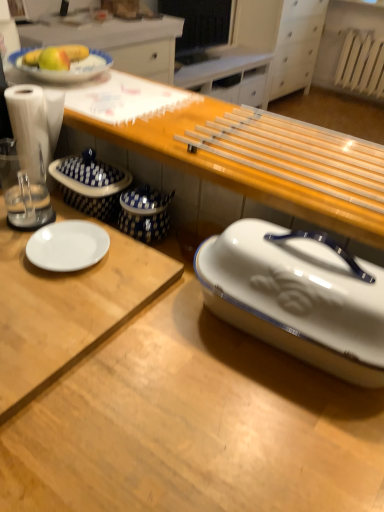
Question: Is yellow matte apple at upper left positioned in front of transparent plastic blender at left?

Choices:
 (A) no
 (B) yes

Answer: (A)

Question: Does yellow matte apple at upper left appear on the right side of transparent plastic blender at left?

Choices:
 (A) yes
 (B) no

Answer: (B)

Question: Is yellow matte apple at upper left wider than transparent plastic blender at left?

Choices:
 (A) yes
 (B) no

Answer: (B)

Question: Does yellow matte apple at upper left touch transparent plastic blender at left?

Choices:
 (A) no
 (B) yes

Answer: (A)

Question: Considering the relative sizes of yellow matte apple at upper left and transparent plastic blender at left in the image provided, is yellow matte apple at upper left taller than transparent plastic blender at left?

Choices:
 (A) yes
 (B) no

Answer: (B)

Question: Is white plastic radiator at upper right taller or shorter than transparent plastic blender at left?

Choices:
 (A) tall
 (B) short

Answer: (A)

Question: From a real-world perspective, is white plastic radiator at upper right above or below transparent plastic blender at left?

Choices:
 (A) below
 (B) above

Answer: (A)

Question: Considering the positions of point (382, 60) and point (59, 102), is point (382, 60) closer or farther from the camera than point (59, 102)?

Choices:
 (A) closer
 (B) farther

Answer: (B)

Question: Is white plastic radiator at upper right wider or thinner than transparent plastic blender at left?

Choices:
 (A) thin
 (B) wide

Answer: (B)

Question: In the image, is yellow matte apple at upper left positioned in front of or behind white glossy breadbox at lower right?

Choices:
 (A) front
 (B) behind

Answer: (B)

Question: Considering the positions of point (66, 56) and point (329, 358), is point (66, 56) closer or farther from the camera than point (329, 358)?

Choices:
 (A) farther
 (B) closer

Answer: (A)

Question: Considering the positions of yellow matte apple at upper left and white glossy breadbox at lower right in the image, is yellow matte apple at upper left bigger or smaller than white glossy breadbox at lower right?

Choices:
 (A) small
 (B) big

Answer: (A)

Question: From a real-world perspective, relative to white glossy breadbox at lower right, is yellow matte apple at upper left vertically above or below?

Choices:
 (A) above
 (B) below

Answer: (A)

Question: Considering the positions of white glossy plate at left, the 1th desk positioned from the top, and transparent plastic blender at left in the image, is white glossy plate at left, the 1th desk positioned from the top, wider or thinner than transparent plastic blender at left?

Choices:
 (A) thin
 (B) wide

Answer: (B)

Question: Does point (21, 232) appear closer or farther from the camera than point (46, 180)?

Choices:
 (A) farther
 (B) closer

Answer: (B)